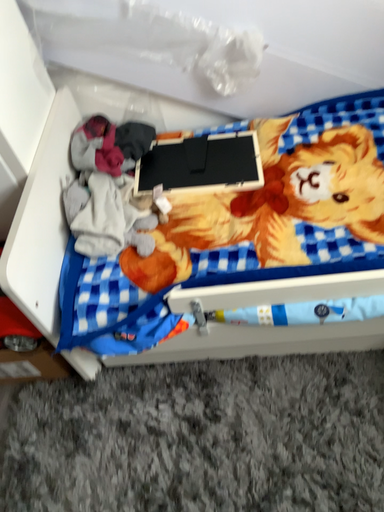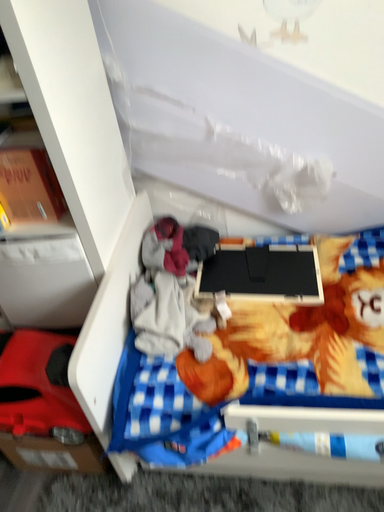
Question: How did the camera likely rotate when shooting the video?

Choices:
 (A) rotated upward
 (B) rotated downward

Answer: (A)